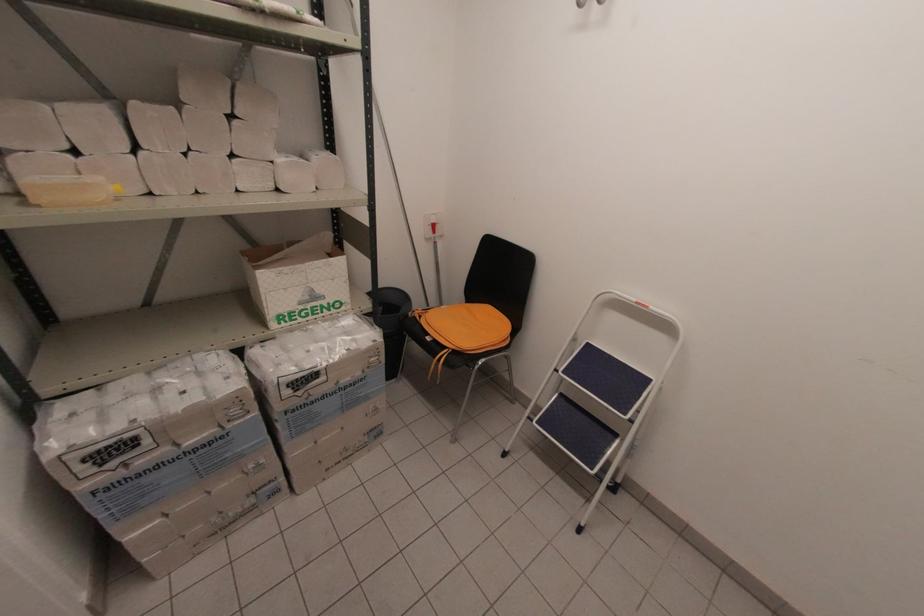
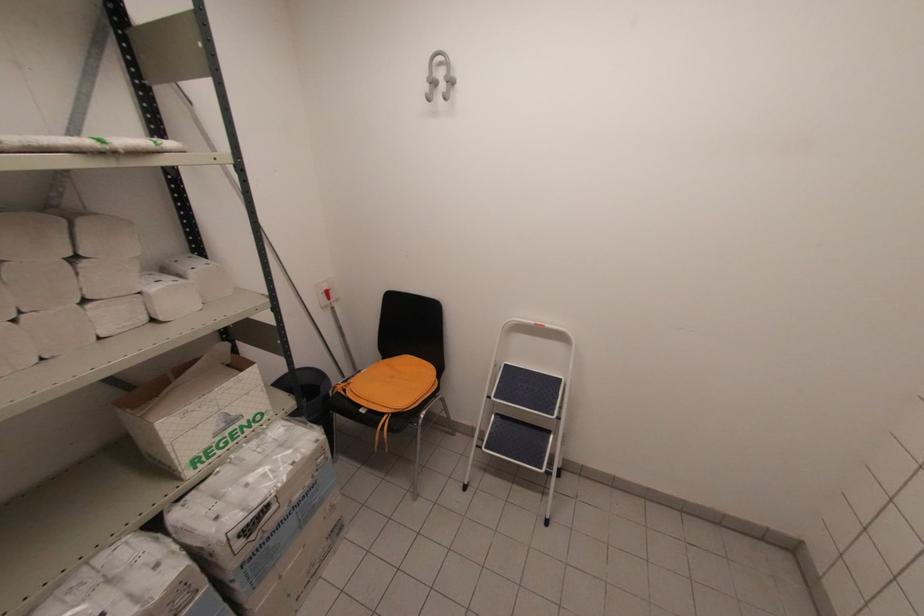
The point at (383,341) is marked in the first image. Where is the corresponding point in the second image?

(325, 437)